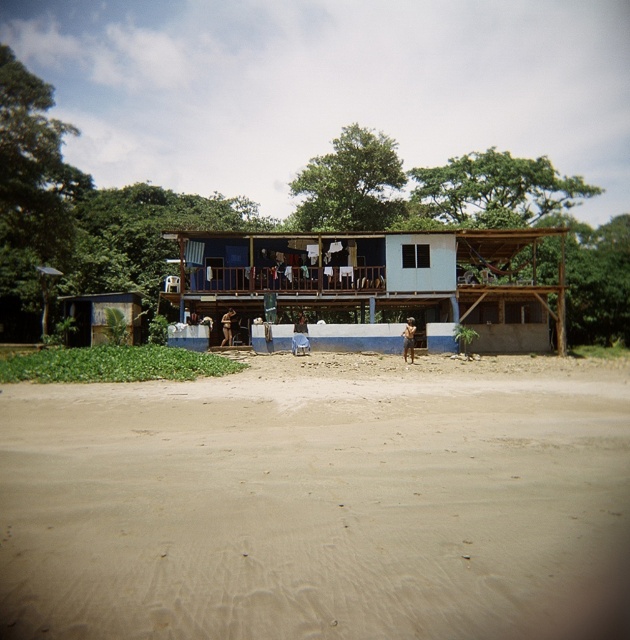
Is beige sandy beach at lower center in front of blue painted wood at center?

That is True.

Does beige sandy beach at lower center appear on the left side of blue painted wood at center?

Yes, beige sandy beach at lower center is to the left of blue painted wood at center.

In order to click on beige sandy beach at lower center in this screenshot , I will do `click(321, 500)`.

Find the location of a particular element. Image resolution: width=630 pixels, height=640 pixels. beige sandy beach at lower center is located at coordinates (321, 500).